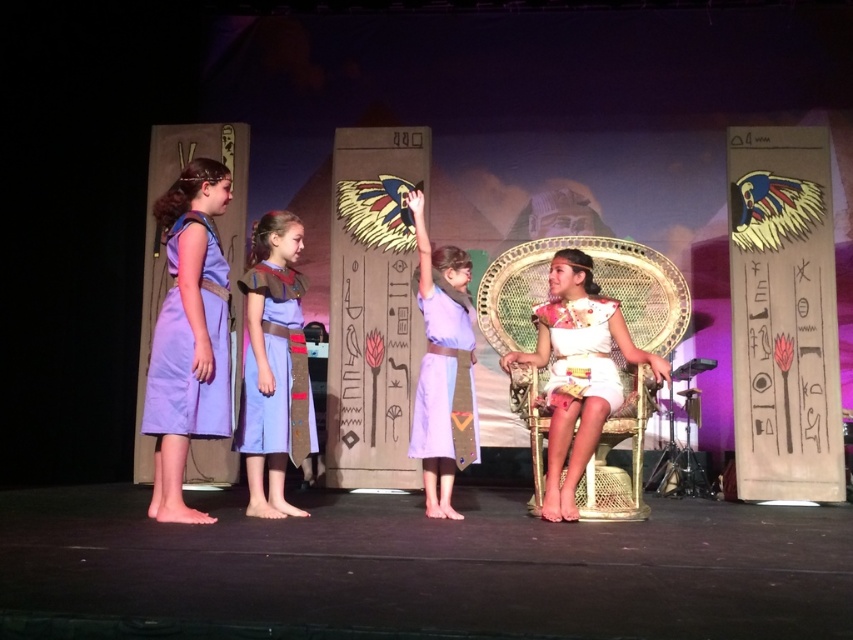
Question: Which point appears farthest from the camera in this image?

Choices:
 (A) (590, 364)
 (B) (280, 442)

Answer: (A)

Question: Is lavender cotton dress at left wider than linen dress at center?

Choices:
 (A) no
 (B) yes

Answer: (A)

Question: Which point is closer to the camera taking this photo?

Choices:
 (A) (541, 307)
 (B) (450, 401)
 (C) (614, 365)
 (D) (169, 333)

Answer: (D)

Question: Is lavender cotton dress at left closer to the viewer compared to matte purple dress at center?

Choices:
 (A) no
 (B) yes

Answer: (B)

Question: Which point is farther to the camera?

Choices:
 (A) (426, 420)
 (B) (276, 435)
 (C) (590, 320)

Answer: (C)

Question: Is white fabric chair at center to the left of lavender cotton dress at left from the viewer's perspective?

Choices:
 (A) yes
 (B) no

Answer: (B)